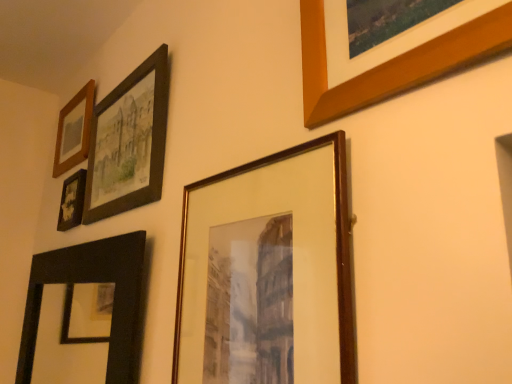
Question: Can wooden frame at upper left, the 6th picture frame positioned from the right, be found inside matte black photo frame at upper left, the 2th picture frame viewed from the left?

Choices:
 (A) yes
 (B) no

Answer: (B)

Question: Considering the relative positions of matte black photo frame at upper left, the 2th picture frame viewed from the left, and wooden frame at upper left, the 6th picture frame positioned from the right, in the image provided, is matte black photo frame at upper left, the 2th picture frame viewed from the left, to the left of wooden frame at upper left, the 6th picture frame positioned from the right, from the viewer's perspective?

Choices:
 (A) yes
 (B) no

Answer: (B)

Question: From the image's perspective, does matte black photo frame at upper left, the 2th picture frame viewed from the left, appear higher than wooden frame at upper left, the 1th picture frame positioned from the left?

Choices:
 (A) no
 (B) yes

Answer: (A)

Question: Considering the relative sizes of matte black photo frame at upper left, the 2th picture frame viewed from the left, and wooden frame at upper left, the 6th picture frame positioned from the right, in the image provided, is matte black photo frame at upper left, the 2th picture frame viewed from the left, wider than wooden frame at upper left, the 6th picture frame positioned from the right,?

Choices:
 (A) yes
 (B) no

Answer: (B)

Question: Is matte black photo frame at upper left, the 2th picture frame viewed from the left, outside of wooden frame at upper left, the 6th picture frame positioned from the right?

Choices:
 (A) yes
 (B) no

Answer: (A)

Question: Considering the positions of matte black frame at upper left, the fourth picture frame viewed from the left, and wooden frame at center, the fifth picture frame viewed from the left, in the image, is matte black frame at upper left, the fourth picture frame viewed from the left, taller or shorter than wooden frame at center, the fifth picture frame viewed from the left,?

Choices:
 (A) tall
 (B) short

Answer: (B)

Question: From a real-world perspective, is matte black frame at upper left, the 3th picture frame from the right, positioned above or below wooden frame at center, placed as the 2th picture frame when sorted from right to left?

Choices:
 (A) below
 (B) above

Answer: (B)

Question: From the image's perspective, is matte black frame at upper left, the fourth picture frame viewed from the left, positioned above or below wooden frame at center, the fifth picture frame viewed from the left?

Choices:
 (A) below
 (B) above

Answer: (B)

Question: Visually, is matte black frame at upper left, the fourth picture frame viewed from the left, positioned to the left or to the right of wooden frame at center, the fifth picture frame viewed from the left?

Choices:
 (A) left
 (B) right

Answer: (A)

Question: Is wooden frame at center, the fifth picture frame viewed from the left, to the left or to the right of matte black frame at upper left, the fourth picture frame viewed from the left, in the image?

Choices:
 (A) right
 (B) left

Answer: (A)

Question: Is wooden frame at center, the fifth picture frame viewed from the left, wider or thinner than matte black frame at upper left, the fourth picture frame viewed from the left?

Choices:
 (A) thin
 (B) wide

Answer: (A)

Question: Is wooden frame at center, placed as the 2th picture frame when sorted from right to left, taller or shorter than matte black frame at upper left, the 3th picture frame from the right?

Choices:
 (A) short
 (B) tall

Answer: (B)

Question: From a real-world perspective, is wooden frame at center, placed as the 2th picture frame when sorted from right to left, physically located above or below matte black frame at upper left, the fourth picture frame viewed from the left?

Choices:
 (A) below
 (B) above

Answer: (A)

Question: Would you say wooden frame at center, placed as the 2th picture frame when sorted from right to left, is to the left or to the right of wooden frame at upper left, the 1th picture frame positioned from the left, in the picture?

Choices:
 (A) left
 (B) right

Answer: (B)

Question: From a real-world perspective, is wooden frame at center, the fifth picture frame viewed from the left, physically located above or below wooden frame at upper left, the 6th picture frame positioned from the right?

Choices:
 (A) above
 (B) below

Answer: (B)